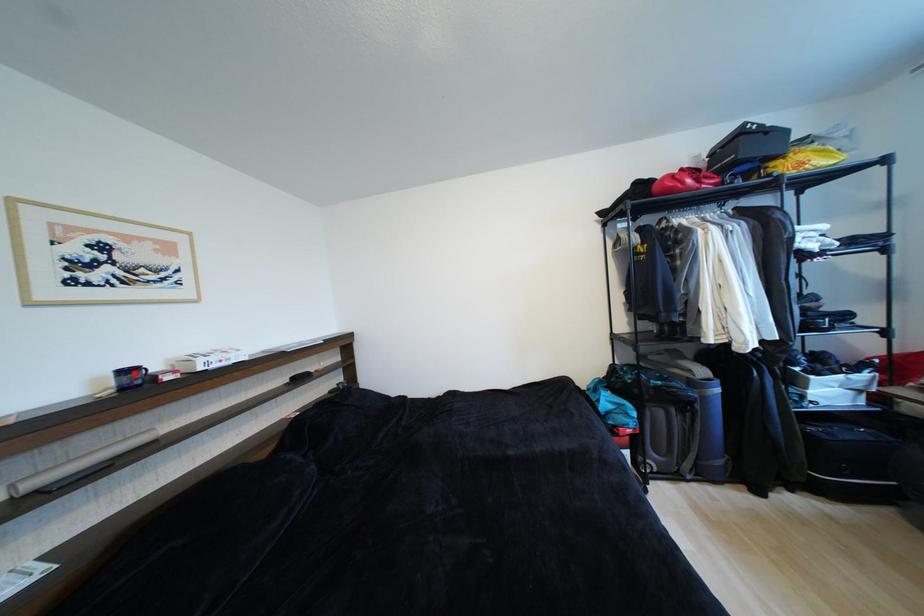
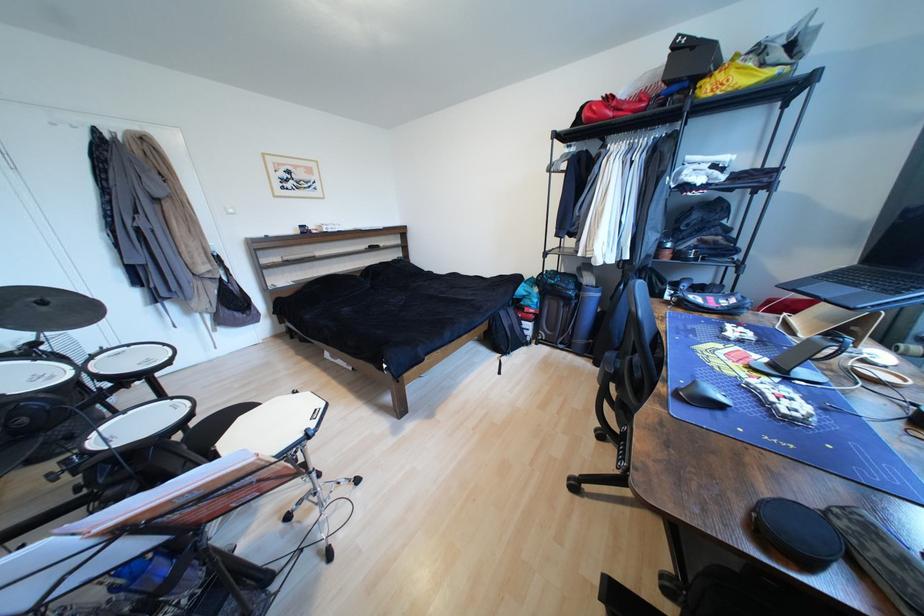
The point at the highlighted location is marked in the first image. Where is the corresponding point in the second image?

(310, 228)